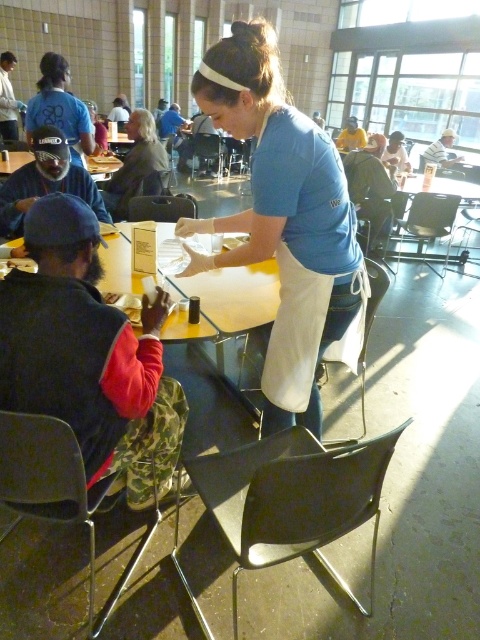
You are a guest at the communal dining area and notice two shirts worn by the server in the foreground. The blue cotton shirt at center and the matte blue shirt at center. Which shirt is wider?

The blue cotton shirt at center is wider than the matte blue shirt at center according to the description provided.

Based on the photo, you are a guest at this communal dining event and notice two shirts at the center of the scene. Which one is taller between the blue cotton shirt at center and the matte blue shirt at center?

The blue cotton shirt at center is much taller than the matte blue shirt at center.

You are a guest at this communal dining area and want to locate the server wearing the blue cotton shirt at center. According to the scene description, where exactly is the server positioned relative to the tables?

The blue cotton shirt at center is located at point [283,220], which places the server centrally positioned in the dining area, likely near the tables where diners are seated.